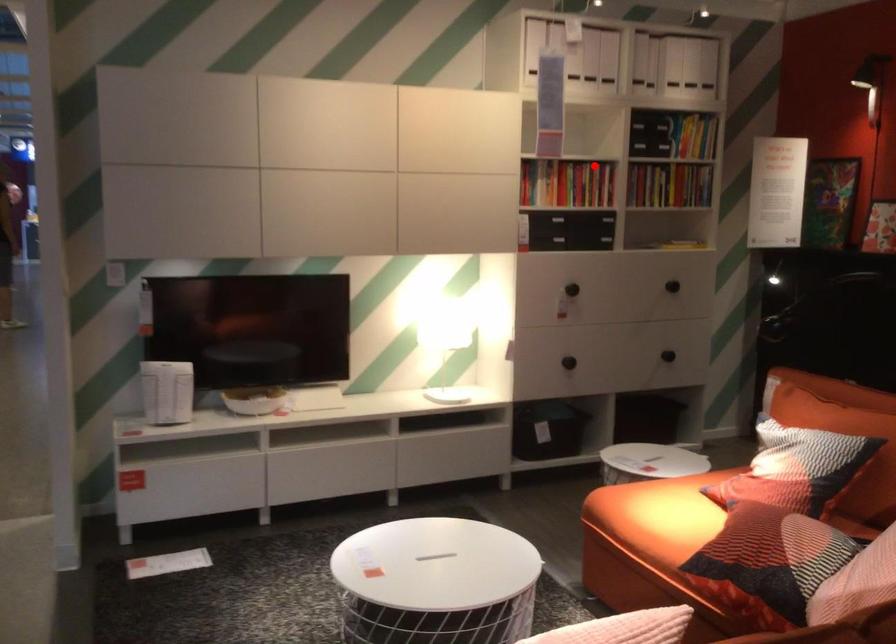
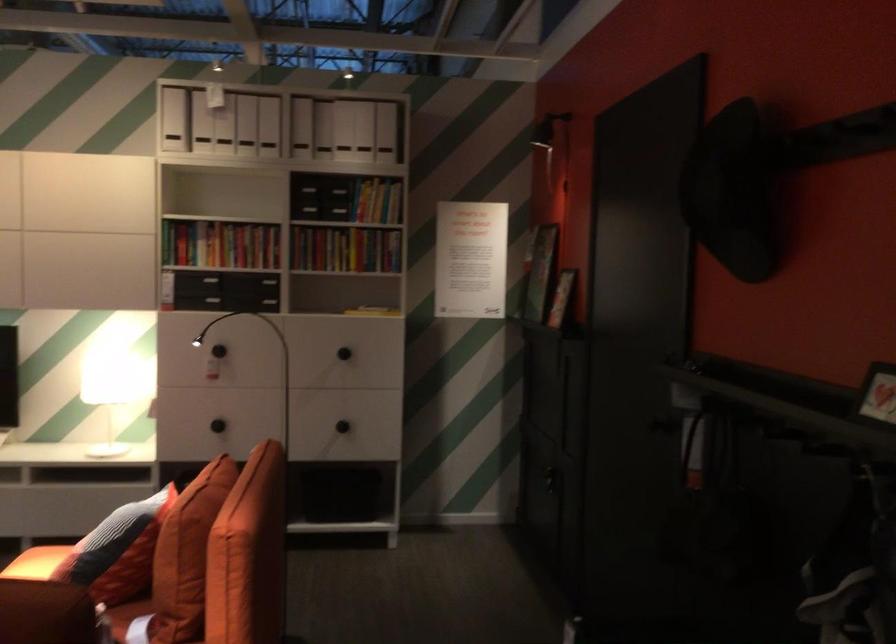
Locate, in the second image, the point that corresponds to the highlighted location in the first image.

(220, 243)